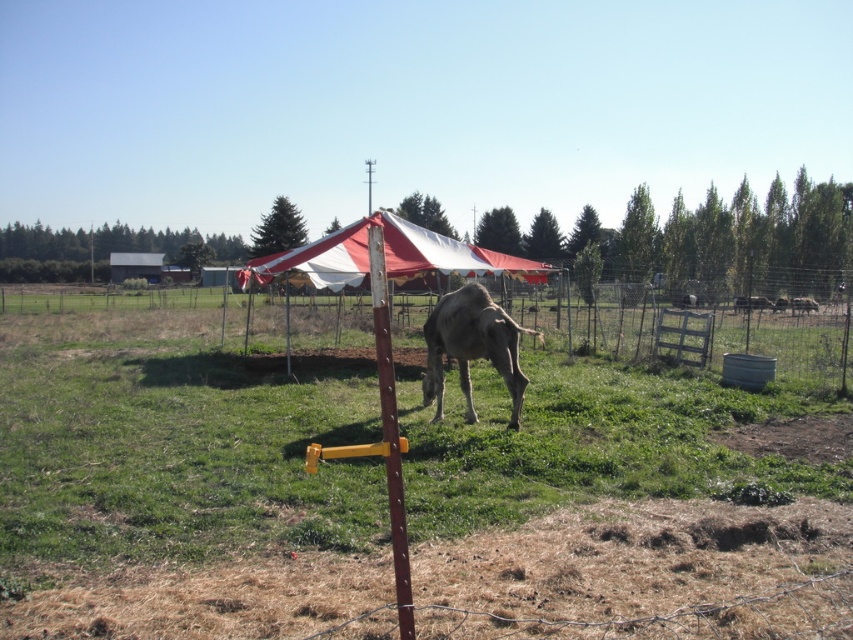
You are a photographer trying to capture both the gray matte camel at center and the brown matte cow at center in a single frame. Given their heights, which animal will appear larger in the photo?

The gray matte camel at center will appear larger in the photo because it is much taller than the brown matte cow at center.